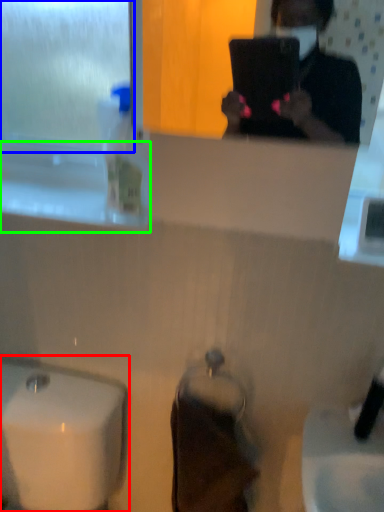
Question: Which object is the farthest from sink (highlighted by a red box)? Choose among these: window screen (highlighted by a blue box) or window sill (highlighted by a green box).

Choices:
 (A) window screen
 (B) window sill

Answer: (A)